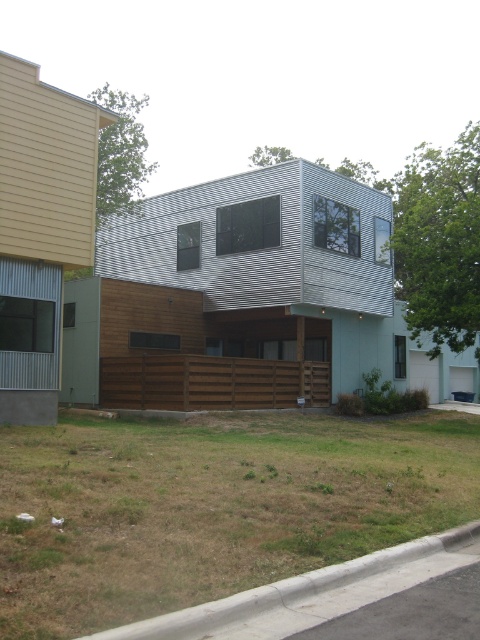
Does brown dry grass at lower center have a lesser height compared to gray concrete curb at lower right?

Incorrect, brown dry grass at lower center's height does not fall short of gray concrete curb at lower right's.

Does brown dry grass at lower center come in front of gray concrete curb at lower right?

No, it is not.

Is point (276, 500) positioned before point (273, 593)?

No, (276, 500) is further to viewer.

The height and width of the screenshot is (640, 480). In order to click on brown dry grass at lower center in this screenshot , I will do `click(211, 506)`.